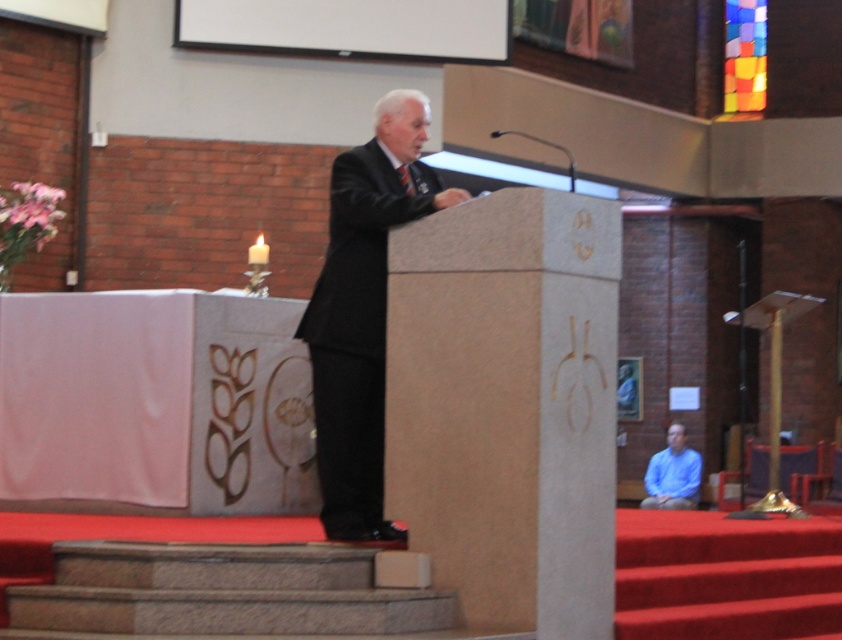
You are standing at the entrance of the venue and want to approach the dark suit at center and the blue matte shirt at lower right. Which one would you reach first if you walk straight towards them?

The dark suit at center is closer to you than the blue matte shirt at lower right since it is only 8.63 meters away, so you would reach the dark suit at center first.

You are an event planner arranging seating for a ceremony. You need to ensure that the dark suit at center and the blue matte shirt at lower right have enough space between them. Based on their sizes, which one requires more space due to its width?

The dark suit at center requires more space because its width is larger than the blue matte shirt at lower right.